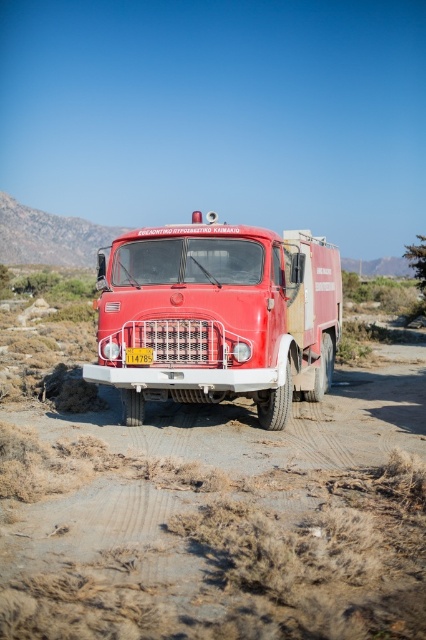
Question: Among these objects, which one is farthest from the camera?

Choices:
 (A) shiny red fire truck at center
 (B) yellow metallic license plate at center

Answer: (B)

Question: Is shiny red fire truck at center bigger than yellow metallic license plate at center?

Choices:
 (A) no
 (B) yes

Answer: (B)

Question: Which of the following is the farthest from the observer?

Choices:
 (A) (291, 257)
 (B) (152, 349)

Answer: (A)

Question: Is shiny red fire truck at center positioned behind yellow metallic license plate at center?

Choices:
 (A) no
 (B) yes

Answer: (A)

Question: Which point appears closest to the camera in this image?

Choices:
 (A) (129, 353)
 (B) (233, 353)

Answer: (B)

Question: Is shiny red fire truck at center to the right of yellow metallic license plate at center from the viewer's perspective?

Choices:
 (A) yes
 (B) no

Answer: (B)